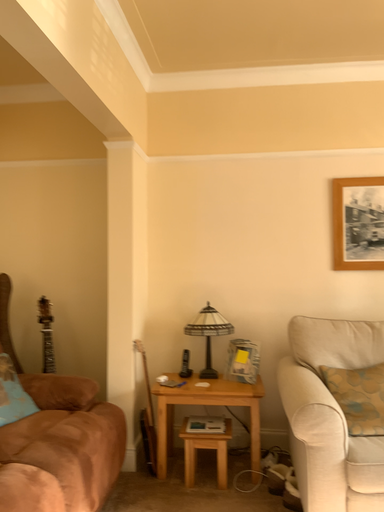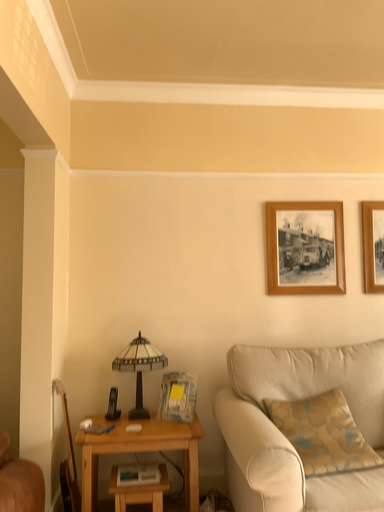
Question: How did the camera likely rotate when shooting the video?

Choices:
 (A) rotated left
 (B) rotated right

Answer: (B)